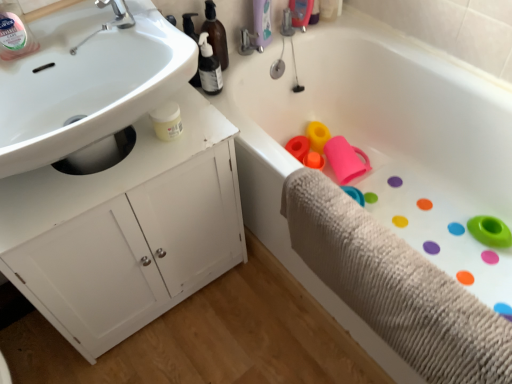
The image size is (512, 384). Identify the location of empty space that is ontop of beige textured bath towel at lower right. (389, 249).